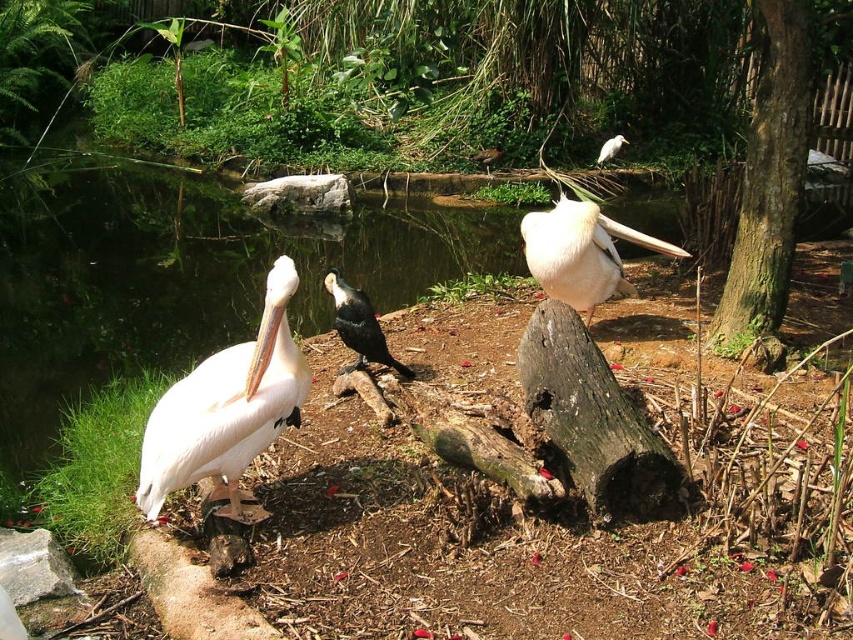
Consider the image. Is white matte pelican at center shorter than shiny black bird at center?

Incorrect, white matte pelican at center's height does not fall short of shiny black bird at center's.

Locate an element on the screen. This screenshot has width=853, height=640. white matte pelican at center is located at coordinates (581, 252).

Is point (83, 224) farther from viewer compared to point (364, 308)?

Yes, it is.

Looking at this image, which is above, transparent water at center or shiny black bird at center?

shiny black bird at center

Is point (16, 291) less distant than point (399, 368)?

No, (16, 291) is further to viewer.

This screenshot has height=640, width=853. Identify the location of transparent water at center. (190, 278).

Who is lower down, transparent water at center or white matte pelican at center?

transparent water at center is lower down.

Between transparent water at center and white matte pelican at center, which one appears on the right side from the viewer's perspective?

white matte pelican at center

I want to click on transparent water at center, so click(190, 278).